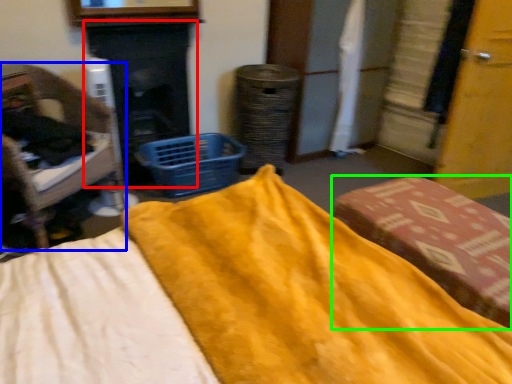
Question: Considering the real-world distances, which object is farthest from fireplace (highlighted by a red box)? furniture (highlighted by a blue box) or furniture (highlighted by a green box)?

Choices:
 (A) furniture
 (B) furniture

Answer: (B)